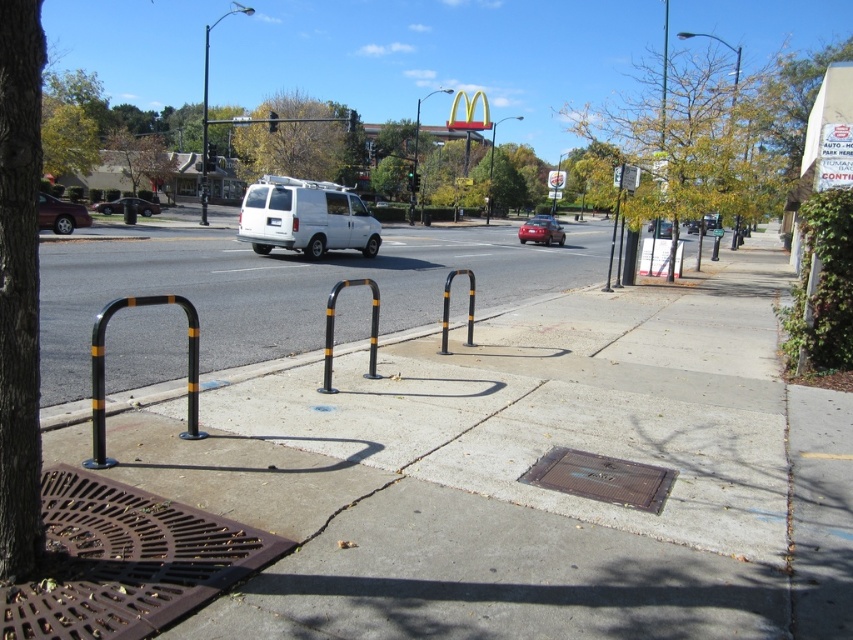
You are standing on the sidewalk and want to walk from point (560, 234) to point (654, 221). Which direction should you face to move towards the correct point?

You should face away from the viewer because point (654, 221) is further away from you than point (560, 234).

You are standing on the sidewalk and see the brown textured manhole cover at center and the metallic pole at upper center. Which object is nearer to you?

The brown textured manhole cover at center is closer to the viewer than the metallic pole at upper center.

You are a pedestrian standing on the sidewalk and want to cross the road to reach the McDonalds sign. You see the white matte van at center and the matte red car at center. Which vehicle is closer to you?

The white matte van at center is above the matte red car at center, so the white matte van at center is closer to you.